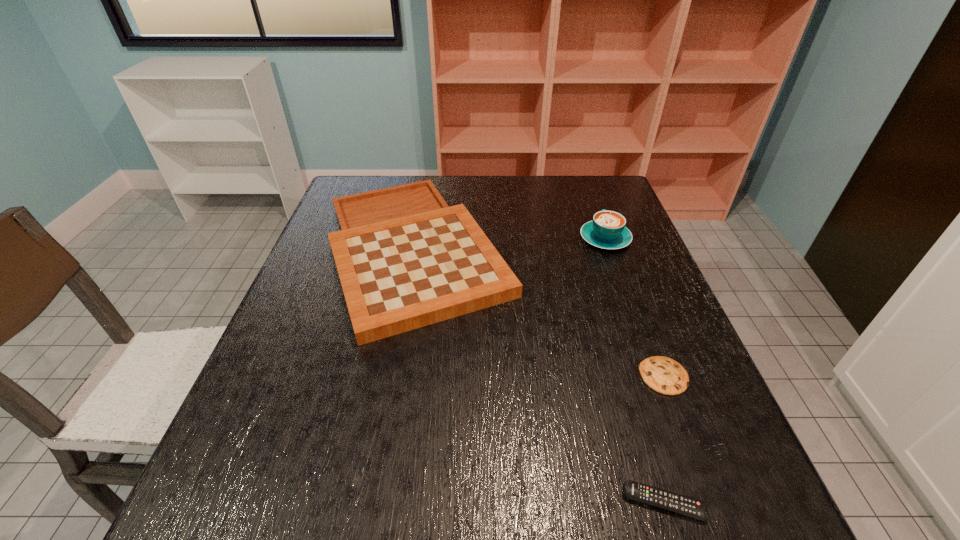
Locate an element on the screen. vacant position located 0.220m on the left of the remote control is located at coordinates 486,502.

This screenshot has width=960, height=540. Identify the location of object located at the far edge. click(405, 259).

Locate an element on the screen. Image resolution: width=960 pixels, height=540 pixels. object positioned at the near edge is located at coordinates (677, 503).

Where is `object present at the left edge`? object present at the left edge is located at coordinates (405, 259).

Image resolution: width=960 pixels, height=540 pixels. I want to click on cappuccino present at the right edge, so tap(607, 230).

This screenshot has width=960, height=540. Find the location of `cookie at the right edge`. cookie at the right edge is located at coordinates (664, 375).

Find the location of `remote control located in the right edge section of the desktop`. remote control located in the right edge section of the desktop is located at coordinates pos(677,503).

Image resolution: width=960 pixels, height=540 pixels. Identify the location of object present at the far left corner. (405, 259).

This screenshot has height=540, width=960. In order to click on object present at the near right corner in this screenshot , I will do `click(677, 503)`.

What are the coordinates of `vacant space at the far edge of the desktop` in the screenshot? It's located at click(526, 202).